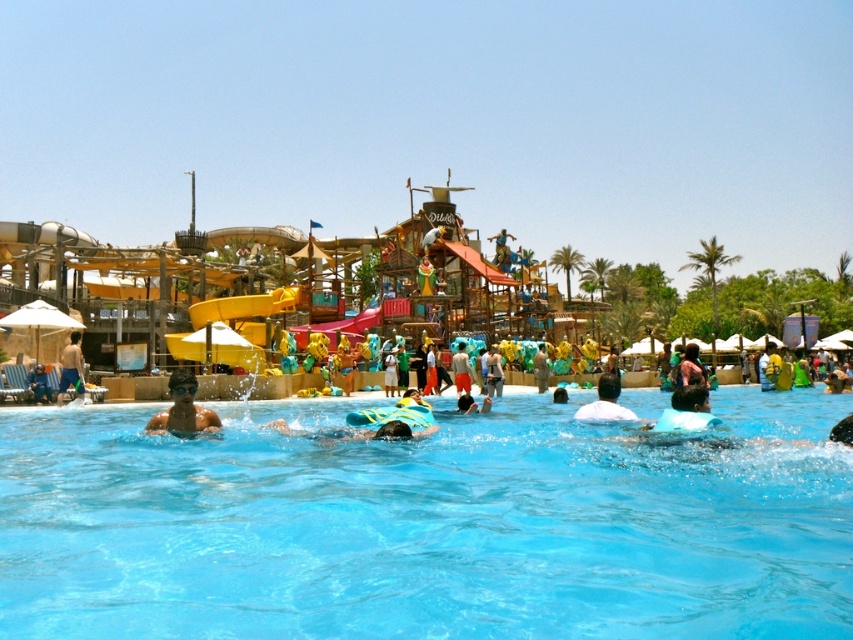
Is wooden pirate ship at center shorter than matte black swimmer at lower left?

In fact, wooden pirate ship at center may be taller than matte black swimmer at lower left.

Can you confirm if wooden pirate ship at center is positioned above matte black swimmer at lower left?

Indeed, wooden pirate ship at center is positioned over matte black swimmer at lower left.

What do you see at coordinates (404, 284) in the screenshot?
I see `wooden pirate ship at center` at bounding box center [404, 284].

Where is `wooden pirate ship at center`? This screenshot has height=640, width=853. wooden pirate ship at center is located at coordinates (404, 284).

Can you confirm if transparent blue water at center is shorter than wooden pirate ship at center?

Yes, transparent blue water at center is shorter than wooden pirate ship at center.

Does point (699, 481) come in front of point (399, 282)?

That is True.

This screenshot has width=853, height=640. In order to click on transparent blue water at center in this screenshot , I will do `click(415, 529)`.

Is point (387, 600) positioned in front of point (636, 417)?

Yes, it is in front of point (636, 417).

Is transparent blue water at center to the right of white matte shirt at center from the viewer's perspective?

In fact, transparent blue water at center is to the left of white matte shirt at center.

Image resolution: width=853 pixels, height=640 pixels. I want to click on transparent blue water at center, so click(415, 529).

You are a GUI agent. You are given a task and a screenshot of the screen. Output one action in this format:
    pyautogui.click(x=<x>, y=<y>)
    Task: Click on the transparent blue water at center
    This screenshot has height=640, width=853.
    Given the screenshot: What is the action you would take?
    pyautogui.click(x=415, y=529)